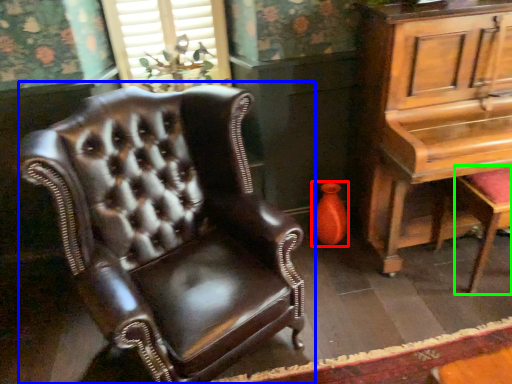
Question: Which object is the farthest from vase (highlighted by a red box)? Choose among these: chair (highlighted by a blue box) or music stool (highlighted by a green box).

Choices:
 (A) chair
 (B) music stool

Answer: (A)